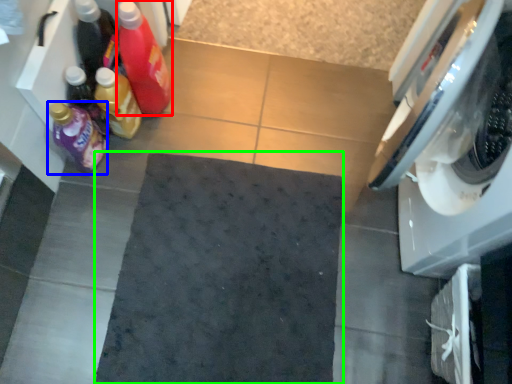
Question: Considering the real-world distances, which object is farthest from bottle (highlighted by a red box)? bottle (highlighted by a blue box) or bath mat (highlighted by a green box)?

Choices:
 (A) bottle
 (B) bath mat

Answer: (B)